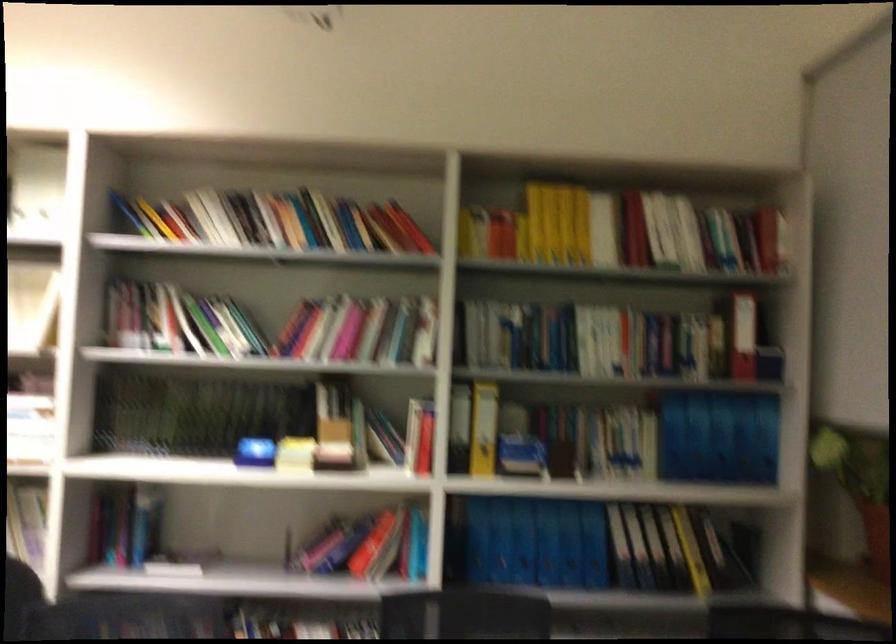
The location [767,238] corresponds to which object?

This point indicates the red book.